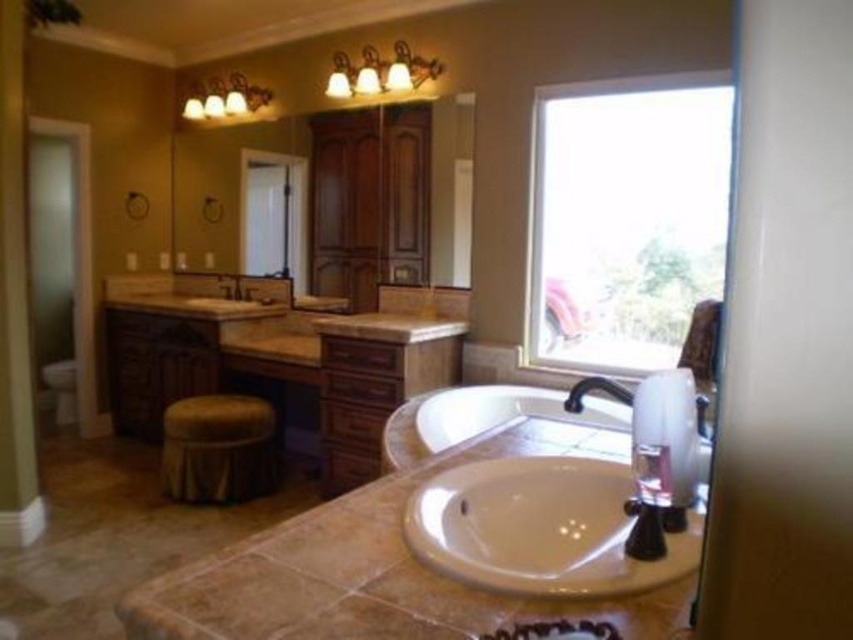
Question: Which point is closer to the camera?

Choices:
 (A) white glossy sink at center
 (B) white glossy bathtub at center

Answer: (A)

Question: Is brown wood vanity at center thinner than white glossy bathtub at center?

Choices:
 (A) no
 (B) yes

Answer: (A)

Question: Is beige tile countertop at center bigger than clear glass window at upper right?

Choices:
 (A) yes
 (B) no

Answer: (B)

Question: Does beige tile countertop at center have a larger size compared to brown wood vanity at center?

Choices:
 (A) no
 (B) yes

Answer: (A)

Question: Which point appears farthest from the camera in this image?

Choices:
 (A) (225, 296)
 (B) (532, 396)
 (C) (196, 429)

Answer: (A)

Question: Which of the following is the farthest from the observer?

Choices:
 (A) (576, 324)
 (B) (601, 388)
 (C) (236, 275)
 (D) (291, 333)

Answer: (C)